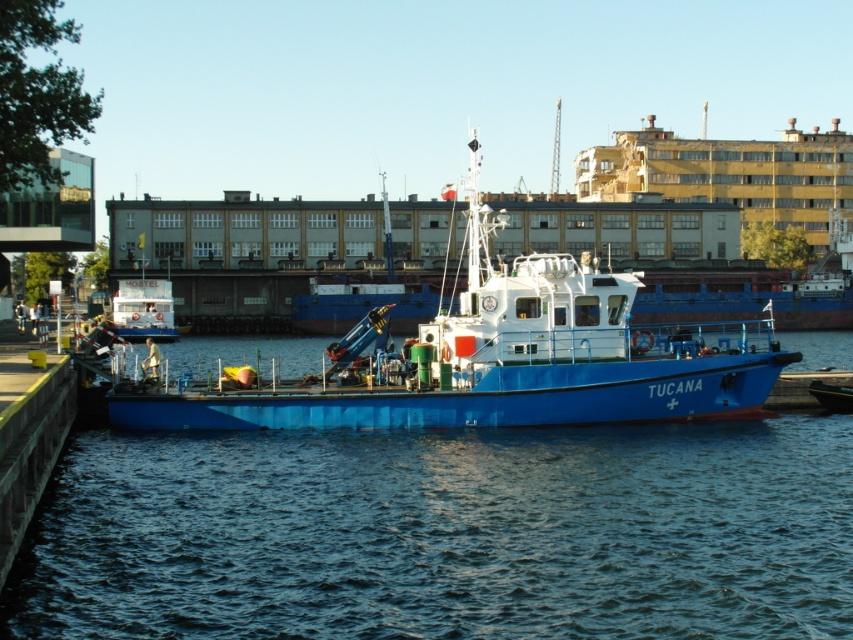
You are a marine biologist preparing to board a vessel for a research trip. You have two options available to you based on the image provided. The blue rubber boat at center and the white glossy boat at center. Which boat should you choose if you need a vessel that can accommodate a larger team of researchers?

The white glossy boat at center is taller than the blue rubber boat at center, so it can accommodate a larger team of researchers.

You are a dock worker who needs to retrieve the white glossy boat at center for maintenance. Can you access it easily from the blue rubber boat at center?

The blue rubber boat at center is positioned under the white glossy boat at center, so you cannot access the white glossy boat at center easily from the blue rubber boat at center due to their vertical positioning.

You are a photographer standing on the pier and want to capture both the blue and white boat named TUCANA and the distant horizon in your shot. You notice two points marked on your camera screen at coordinates point (140, 604) and point (647, 360). Which point should you focus on to ensure both the boat and the horizon are in clear view?

You should focus on point (140, 604) because it is closer to the camera than point (647, 360), allowing both the boat and the horizon to be in focus.